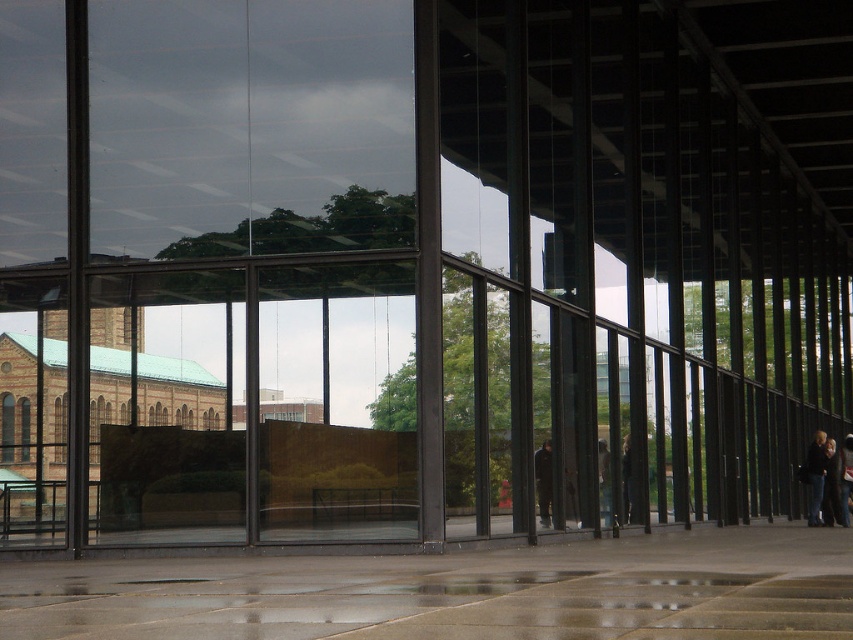
Question: Based on their relative distances, which object is nearer to the transparent glass door at center?

Choices:
 (A) dark brown leather jacket at center
 (B) dark gray jacket at lower right
 (C) dark gray fabric jacket at center
 (D) dark blue jeans at right

Answer: (C)

Question: Does dark gray fabric jacket at center have a smaller size compared to dark blue jeans at right?

Choices:
 (A) yes
 (B) no

Answer: (A)

Question: Which point is farther from the camera taking this photo?

Choices:
 (A) (x=820, y=524)
 (B) (x=113, y=368)

Answer: (A)

Question: Among these points, which one is farthest from the camera?

Choices:
 (A) (630, 481)
 (B) (840, 524)
 (C) (410, 470)
 (D) (837, 460)

Answer: (D)

Question: Does transparent glass door at center appear under dark blue jacket at lower right?

Choices:
 (A) yes
 (B) no

Answer: (B)

Question: Is dark gray fabric jacket at center wider than dark brown leather jacket at center?

Choices:
 (A) no
 (B) yes

Answer: (B)